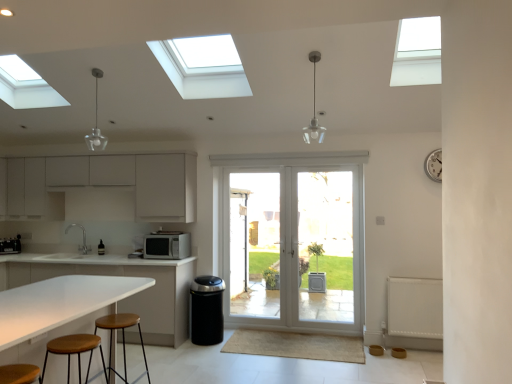
The image size is (512, 384). What are the coordinates of `free spot below white textured radiator at lower right (from a real-world perspective)` in the screenshot? It's located at (410, 345).